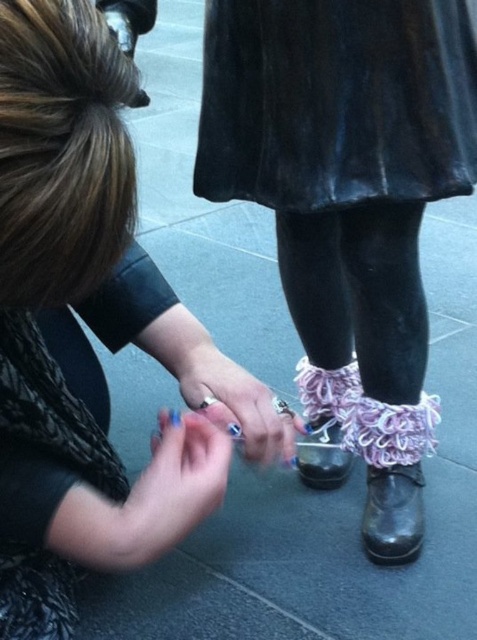
Question: In this image, where is ruffled fabric socks at center located relative to nail-polished skin at center?

Choices:
 (A) below
 (B) above

Answer: (B)

Question: Can you confirm if ruffled fabric socks at center is positioned to the left of black leather shoe at lower center?

Choices:
 (A) no
 (B) yes

Answer: (A)

Question: Which of the following is the farthest from the observer?

Choices:
 (A) (198, 460)
 (B) (276, 452)

Answer: (B)

Question: Which point is farther to the camera?

Choices:
 (A) (314, 432)
 (B) (72, 248)

Answer: (A)

Question: Based on their relative distances, which object is farther from the pink lace socks at lower right?

Choices:
 (A) velvet black dress at upper center
 (B) blue painted nails at center
 (C) nail-polished skin at center
 (D) ruffled fabric socks at center

Answer: (A)

Question: Can you confirm if blue painted nails at center is wider than black leather shoe at lower center?

Choices:
 (A) yes
 (B) no

Answer: (A)